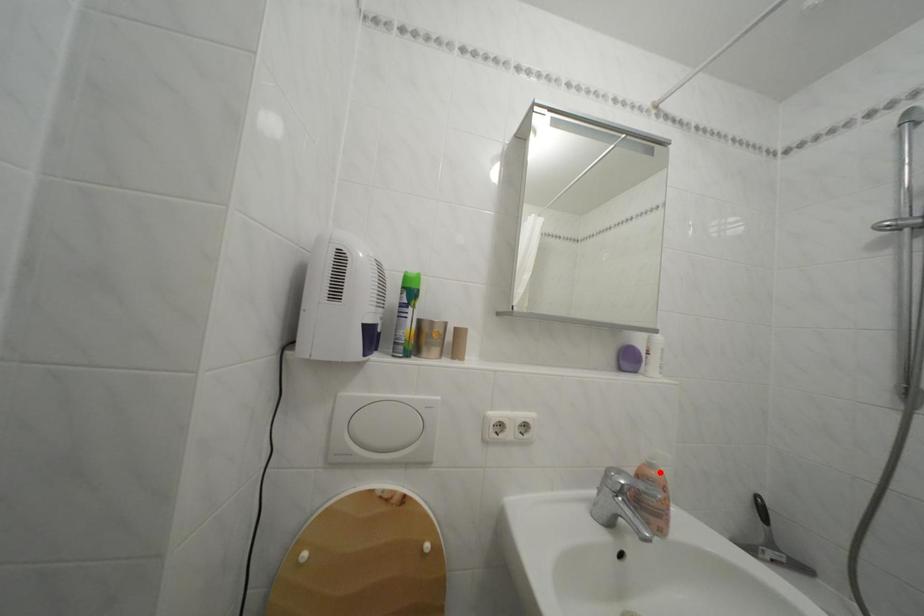
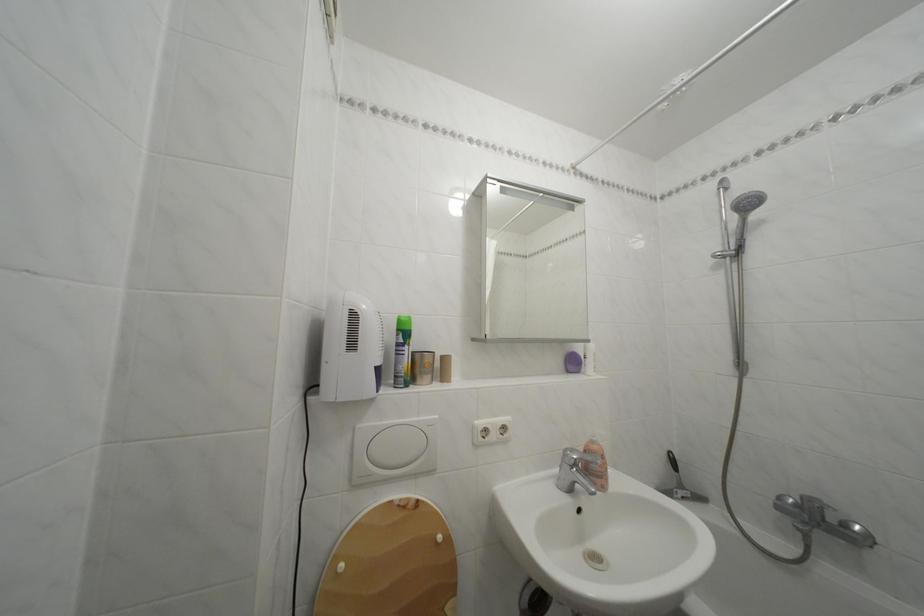
Locate, in the second image, the point that corresponds to the highlighted location in the first image.

(602, 448)